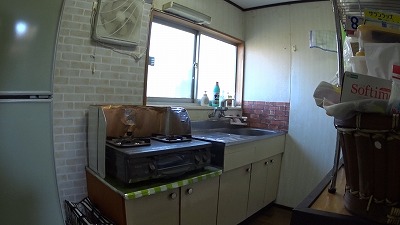
What are the coordinates of `stovetop` in the screenshot? It's located at coord(162,147).